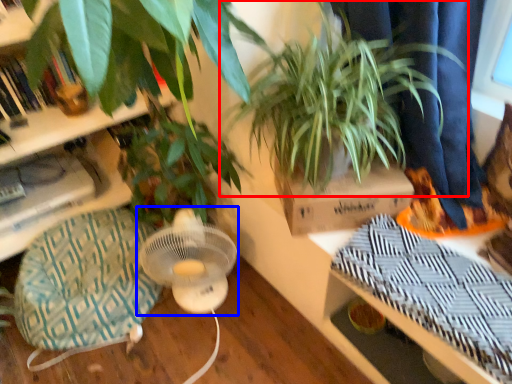
Question: Which object is further to the camera taking this photo, houseplant (highlighted by a red box) or mechanical fan (highlighted by a blue box)?

Choices:
 (A) houseplant
 (B) mechanical fan

Answer: (B)